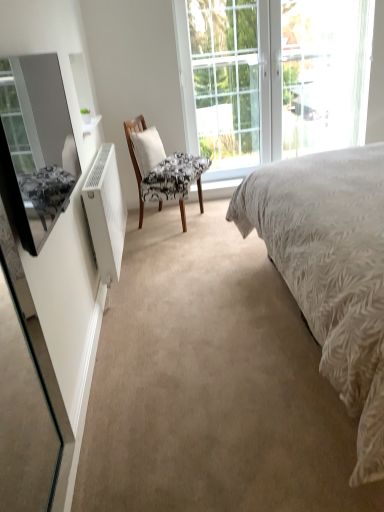
The width and height of the screenshot is (384, 512). Describe the element at coordinates (272, 78) in the screenshot. I see `clear glass window at upper center` at that location.

The height and width of the screenshot is (512, 384). Describe the element at coordinates (35, 147) in the screenshot. I see `matte black mirror at left` at that location.

What do you see at coordinates (105, 213) in the screenshot?
I see `white matte radiator at left` at bounding box center [105, 213].

The height and width of the screenshot is (512, 384). What are the coordinates of `white textured bed at center` in the screenshot? It's located at (331, 270).

Find the location of a particular element. This screenshot has width=384, height=512. clear glass door at center is located at coordinates (225, 83).

Describe the element at coordinates (225, 83) in the screenshot. I see `clear glass door at center` at that location.

Identify the location of patterned fabric chair at center. The height and width of the screenshot is (512, 384). (166, 173).

I want to click on clear glass window at upper center, so click(272, 78).

Based on the photo, would you say white matte radiator at left is a long distance from white textured bed at center?

white matte radiator at left is far away from white textured bed at center.

Considering the relative positions of white matte radiator at left and white textured bed at center in the image provided, is white matte radiator at left to the left of white textured bed at center from the viewer's perspective?

Correct, you'll find white matte radiator at left to the left of white textured bed at center.

Does white matte radiator at left come behind white textured bed at center?

Yes, white matte radiator at left is further from the camera.

Is white textured bed at center at the back of white matte radiator at left?

No, white matte radiator at left is not facing away from white textured bed at center.

From the image's perspective, is white fabric pillow at center positioned above or below matte black mirror at left?

Clearly, from the image's perspective, white fabric pillow at center is above matte black mirror at left.

Which object is further away from the camera, white fabric pillow at center or matte black mirror at left?

white fabric pillow at center is behind.

Considering the sizes of objects white fabric pillow at center and matte black mirror at left in the image provided, who is thinner, white fabric pillow at center or matte black mirror at left?

With smaller width is matte black mirror at left.

What's the angular difference between white fabric pillow at center and matte black mirror at left's facing directions?

26.8 degrees.

Where is `chair above the matte black mirror at left (from the image's perspective)`? This screenshot has height=512, width=384. chair above the matte black mirror at left (from the image's perspective) is located at coordinates (166, 173).

Is patterned fabric chair at center shorter than matte black mirror at left?

No.

Consider the image. Would you consider patterned fabric chair at center to be distant from matte black mirror at left?

No, patterned fabric chair at center is not far away from matte black mirror at left.

Considering the sizes of objects clear glass door at center and white textured bed at center in the image provided, who is bigger, clear glass door at center or white textured bed at center?

white textured bed at center.

Who is more distant, clear glass door at center or white textured bed at center?

clear glass door at center is behind.

From a real-world perspective, is clear glass door at center on white textured bed at center?

Correct, in the physical world, clear glass door at center is higher than white textured bed at center.

Based on the photo, is clear glass door at center to the left or to the right of white textured bed at center in the image?

clear glass door at center is to the left of white textured bed at center.

Which object is positioned more to the right, white textured bed at center or white fabric pillow at center?

From the viewer's perspective, white textured bed at center appears more on the right side.

Do you think white textured bed at center is within white fabric pillow at center, or outside of it?

white textured bed at center is not inside white fabric pillow at center, it's outside.

What's the angular difference between white textured bed at center and white fabric pillow at center's facing directions?

white textured bed at center and white fabric pillow at center are facing 154 degrees away from each other.

Considering the sizes of objects white textured bed at center and white fabric pillow at center in the image provided, who is wider, white textured bed at center or white fabric pillow at center?

white textured bed at center.

Is white textured bed at center to the right of patterned fabric chair at center from the viewer's perspective?

Yes, white textured bed at center is to the right of patterned fabric chair at center.

From the image's perspective, which one is positioned higher, white textured bed at center or patterned fabric chair at center?

patterned fabric chair at center is shown above in the image.

Considering the positions of objects white textured bed at center and patterned fabric chair at center in the image provided, who is behind, white textured bed at center or patterned fabric chair at center?

patterned fabric chair at center is more distant.

In terms of height, does white textured bed at center look taller or shorter compared to patterned fabric chair at center?

Considering their sizes, white textured bed at center has more height than patterned fabric chair at center.

From a real-world perspective, between white textured bed at center and matte black mirror at left, who is vertically lower?

white textured bed at center is physically lower.

What's the angular difference between white textured bed at center and matte black mirror at left's facing directions?

179 degrees separate the facing orientations of white textured bed at center and matte black mirror at left.

Consider the image. Is white textured bed at center aimed at matte black mirror at left?

Yes, white textured bed at center is oriented towards matte black mirror at left.

Measure the distance between white textured bed at center and matte black mirror at left.

white textured bed at center is 1.22 meters away from matte black mirror at left.

Locate an element on the screen. This screenshot has width=384, height=512. bed lying on the right of white matte radiator at left is located at coordinates (331, 270).

The width and height of the screenshot is (384, 512). Identify the location of pillow above the matte black mirror at left (from the image's perspective). (147, 149).

Looking at the image, which one is located closer to clear glass window at upper center, patterned fabric chair at center or white textured bed at center?

The object closer to clear glass window at upper center is patterned fabric chair at center.

Which object lies further to the anchor point white fabric pillow at center, white textured bed at center or white matte radiator at left?

white textured bed at center.

Estimate the real-world distances between objects in this image. Which object is closer to white matte radiator at left, white fabric pillow at center or white textured bed at center?

white fabric pillow at center lies closer to white matte radiator at left than the other object.

Based on their spatial positions, is white fabric pillow at center or clear glass door at center further from matte black mirror at left?

The object further to matte black mirror at left is clear glass door at center.

Based on their spatial positions, is white fabric pillow at center or white matte radiator at left further from clear glass window at upper center?

white matte radiator at left.

From the image, which object appears to be nearer to white fabric pillow at center, clear glass door at center or patterned fabric chair at center?

The object closer to white fabric pillow at center is patterned fabric chair at center.

From the image, which object appears to be farther from white textured bed at center, clear glass window at upper center or matte black mirror at left?

clear glass window at upper center lies further to white textured bed at center than the other object.

Estimate the real-world distances between objects in this image. Which object is closer to matte black mirror at left, white textured bed at center or white matte radiator at left?

white matte radiator at left.

At what (x,y) coordinates should I click in order to perform the action: click on pillow positioned between matte black mirror at left and clear glass door at center from near to far. Please return your answer as a coordinate pair (x, y). The image size is (384, 512). Looking at the image, I should click on (147, 149).

Locate an element on the screen. radiator between matte black mirror at left and clear glass window at upper center from front to back is located at coordinates (105, 213).

Identify the location of glass door between patterned fabric chair at center and clear glass window at upper center. (225, 83).

The height and width of the screenshot is (512, 384). I want to click on window between white matte radiator at left and clear glass door at center along the z-axis, so click(x=272, y=78).